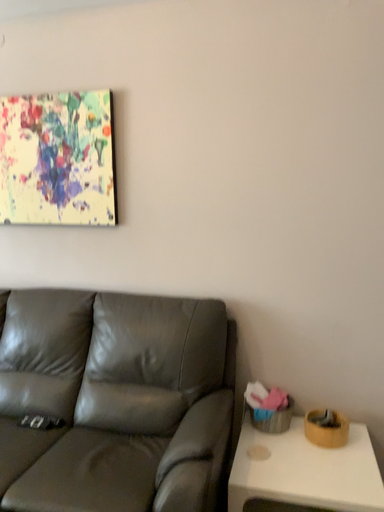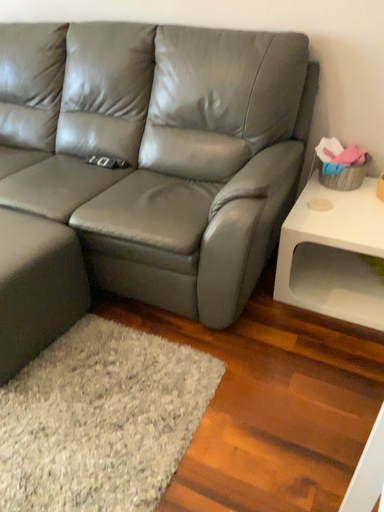
Question: Which way did the camera rotate in the video?

Choices:
 (A) rotated downward
 (B) rotated upward

Answer: (A)